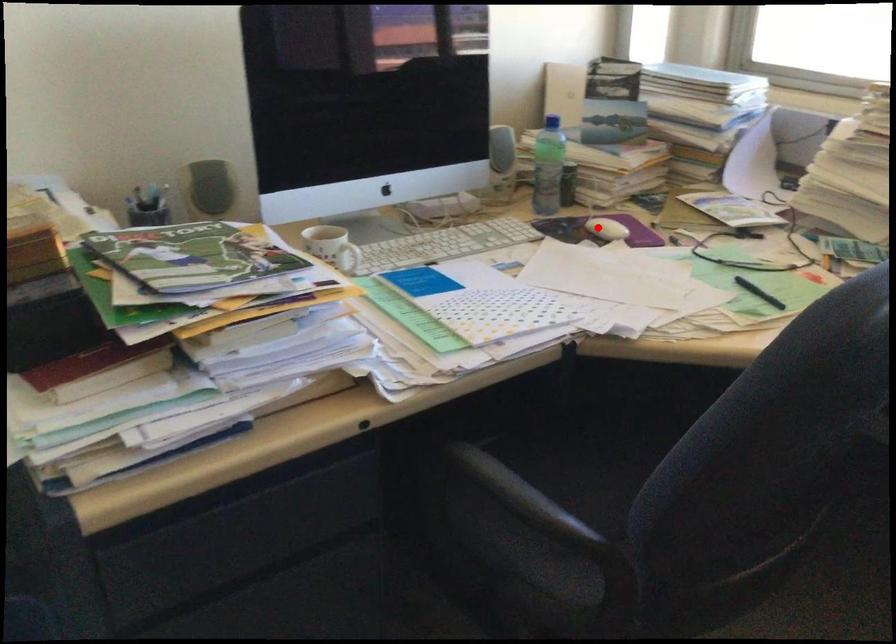
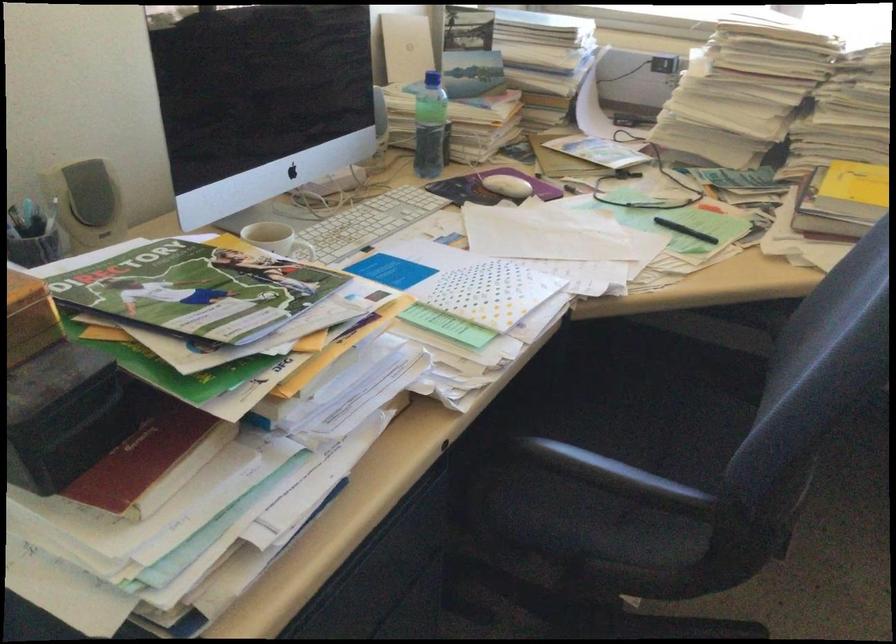
Find the pixel in the second image that matches the highlighted location in the first image.

(506, 185)